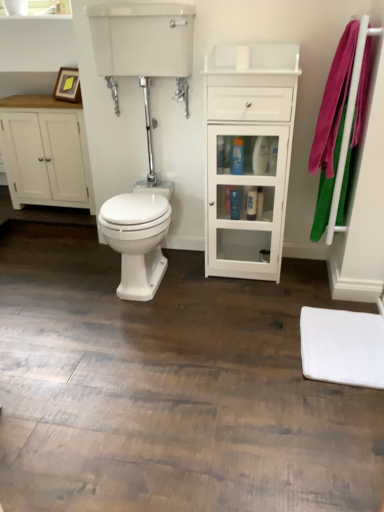
Question: Is pink fabric bath towel at right not within white glossy cabinet at center?

Choices:
 (A) yes
 (B) no

Answer: (A)

Question: Is pink fabric bath towel at right in front of white glossy cabinet at center?

Choices:
 (A) yes
 (B) no

Answer: (A)

Question: Is pink fabric bath towel at right positioned behind white glossy cabinet at center?

Choices:
 (A) yes
 (B) no

Answer: (B)

Question: From a real-world perspective, is pink fabric bath towel at right physically below white glossy cabinet at center?

Choices:
 (A) yes
 (B) no

Answer: (B)

Question: Can you confirm if pink fabric bath towel at right is shorter than white glossy cabinet at center?

Choices:
 (A) yes
 (B) no

Answer: (A)

Question: Considering the positions of white glossy bidet at center and translucent plastic bottle at center, the 2th toiletry positioned from the front, in the image, is white glossy bidet at center taller or shorter than translucent plastic bottle at center, the 2th toiletry positioned from the front,?

Choices:
 (A) tall
 (B) short

Answer: (A)

Question: Considering their positions, is white glossy bidet at center located in front of or behind translucent plastic bottle at center, which appears as the second toiletry when viewed from the top?

Choices:
 (A) front
 (B) behind

Answer: (A)

Question: From the image's perspective, is white glossy bidet at center positioned above or below translucent plastic bottle at center, the 2th toiletry positioned from the front?

Choices:
 (A) below
 (B) above

Answer: (A)

Question: Considering the positions of white glossy bidet at center and translucent plastic bottle at center, the 2th toiletry positioned from the front, in the image, is white glossy bidet at center bigger or smaller than translucent plastic bottle at center, the 2th toiletry positioned from the front,?

Choices:
 (A) big
 (B) small

Answer: (A)

Question: Visually, is pink fabric bath towel at right positioned to the left or to the right of white glossy tank at upper center?

Choices:
 (A) left
 (B) right

Answer: (B)

Question: Is pink fabric bath towel at right wider or thinner than white glossy tank at upper center?

Choices:
 (A) thin
 (B) wide

Answer: (A)

Question: In terms of height, does pink fabric bath towel at right look taller or shorter compared to white glossy tank at upper center?

Choices:
 (A) tall
 (B) short

Answer: (A)

Question: From a real-world perspective, is pink fabric bath towel at right physically located above or below white glossy tank at upper center?

Choices:
 (A) above
 (B) below

Answer: (B)

Question: Is white glossy bidet at center wider or thinner than white matte mat at lower right?

Choices:
 (A) wide
 (B) thin

Answer: (A)

Question: Based on their positions, is white glossy bidet at center located to the left or right of white matte mat at lower right?

Choices:
 (A) left
 (B) right

Answer: (A)